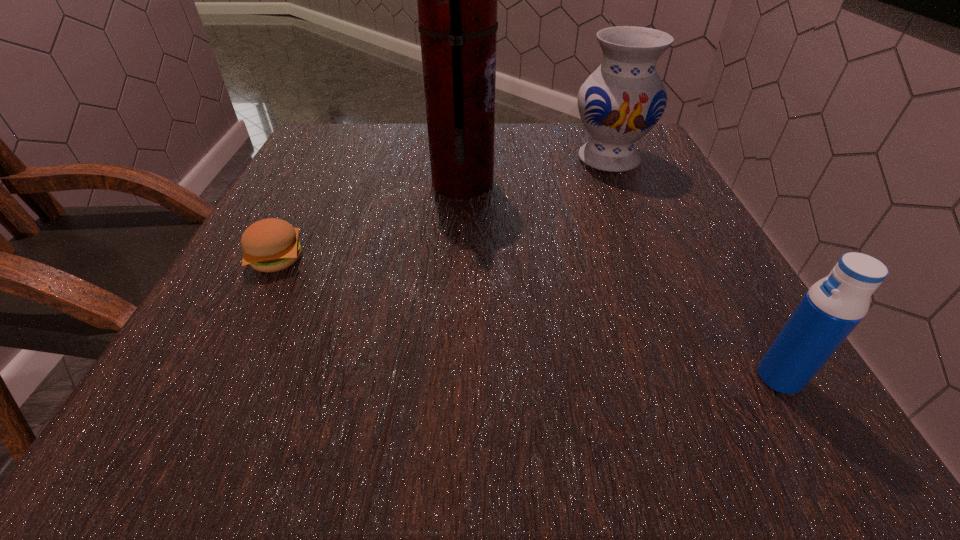
This screenshot has height=540, width=960. Identify the location of vacant space located 0.260m on the front of the leftmost object. (188, 431).

The width and height of the screenshot is (960, 540). I want to click on fire extinguisher that is at the far edge, so click(x=457, y=0).

Where is `vase at the far edge`? The width and height of the screenshot is (960, 540). vase at the far edge is located at coordinates click(x=622, y=100).

This screenshot has width=960, height=540. Find the location of `object present at the near edge`. object present at the near edge is located at coordinates (833, 306).

Identify the location of object at the left edge. The height and width of the screenshot is (540, 960). (270, 245).

Find the location of `vase located at the right edge`. vase located at the right edge is located at coordinates (622, 100).

Image resolution: width=960 pixels, height=540 pixels. Identify the location of water bottle situated at the right edge. (833, 306).

In order to click on object that is at the far right corner in this screenshot , I will do `click(622, 100)`.

The image size is (960, 540). Identify the location of object at the near right corner. (833, 306).

Where is `vacant space at the far edge of the desktop`? vacant space at the far edge of the desktop is located at coordinates (564, 153).